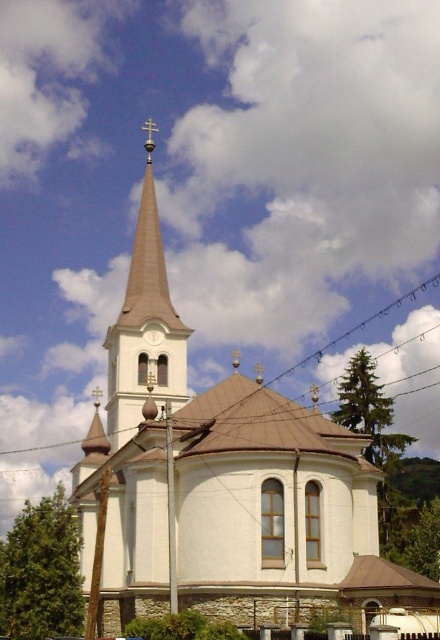
Based on the scene, can you determine if the white stone church at center is wider than the white stucco tower at upper center?

The white stone church at center is wider than the white stucco tower at upper center according to the description.

You are standing in front of the church and want to locate two specific points marked on the image. The first point is at coordinates point (x=121, y=321) and the second is at point (x=154, y=337). Which point is closer to you?

Point (x=121, y=321) is closer to you because it is further to the viewer than point (x=154, y=337).

You are standing in front of the church and want to take a photo of the white stone church at center and the white metallic clock at upper center. Which object should you focus on first to ensure both are in the frame?

You should focus on the white stone church at center first because it is in front of the white metallic clock at upper center, so adjusting the camera to include the closer object will naturally include the background one as well.